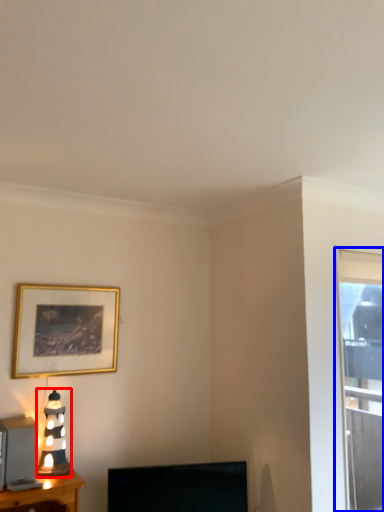
Question: Which object appears closest to the camera in this image, table lamp (highlighted by a red box) or window (highlighted by a blue box)?

Choices:
 (A) table lamp
 (B) window

Answer: (A)